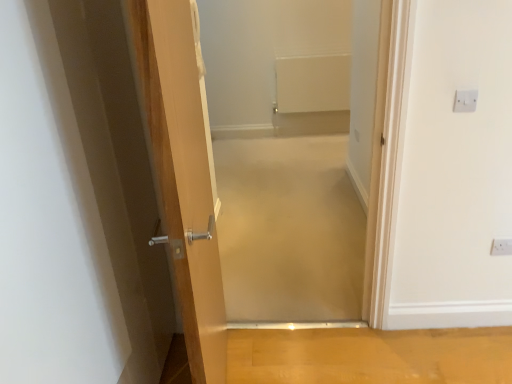
Question: From a real-world perspective, is beige carpet at center, the 1th corridor from the front, above or below wooden floor at lower center?

Choices:
 (A) below
 (B) above

Answer: (B)

Question: From the image's perspective, is beige carpet at center, the 1th corridor from the front, above or below wooden floor at lower center?

Choices:
 (A) below
 (B) above

Answer: (B)

Question: Which object is the farthest from the beige carpet at center, which ranks as the second corridor in back-to-front order?

Choices:
 (A) white plastic electric outlet at upper right, which is the 1th electric outlet in top-to-bottom order
 (B) wooden floor at lower center
 (C) beige carpet at center, placed as the 1th corridor when sorted from back to front
 (D) white plastic electric outlet at upper right, which is counted as the 2th electric outlet, starting from the left

Answer: (A)

Question: Which object is positioned closest to the beige carpet at center, placed as the 1th corridor when sorted from back to front?

Choices:
 (A) beige carpet at center, the 1th corridor from the front
 (B) wooden floor at lower center
 (C) white plastic electric outlet at upper right, which is counted as the 1th electric outlet, starting from the bottom
 (D) white plastic electric outlet at upper right, the first electric outlet viewed from the front

Answer: (A)